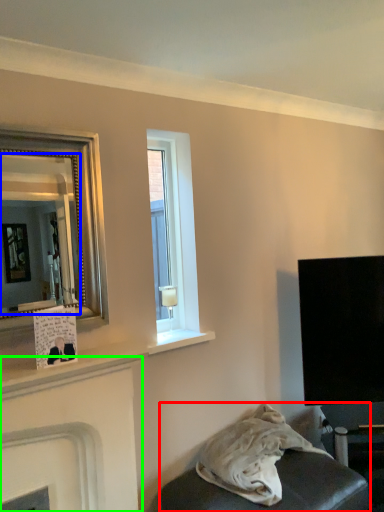
Question: Based on their relative distances, which object is nearer to furniture (highlighted by a red box)? Choose from mirror (highlighted by a blue box) and fireplace (highlighted by a green box).

Choices:
 (A) mirror
 (B) fireplace

Answer: (B)